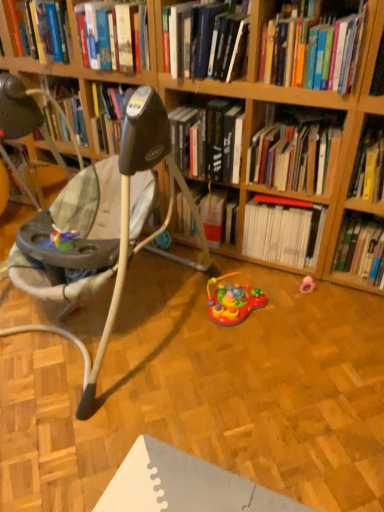
Where is `vacant space that's between beige fabric baby swing at left and multicolored plastic toy at center, the 1th toy viewed from the left`? This screenshot has height=512, width=384. vacant space that's between beige fabric baby swing at left and multicolored plastic toy at center, the 1th toy viewed from the left is located at coordinates (184, 360).